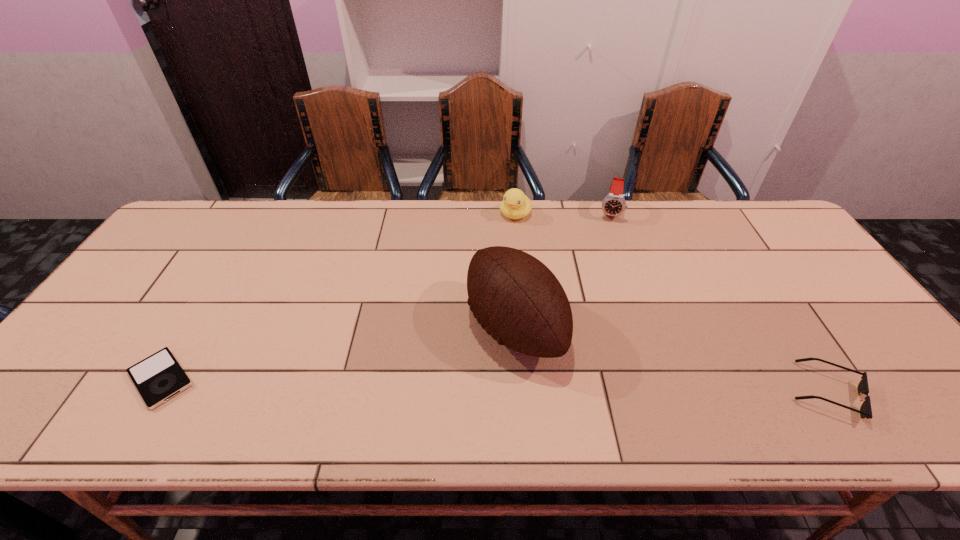
The image size is (960, 540). What are the coordinates of `free space on the desktop that is between the iPod and the fourth tallest object and is positioned on the laces of the tallest object` in the screenshot? It's located at (396, 383).

Identify the location of free spot on the desktop that is between the shortest object and the sunglasses and is positioned on the face of the watch. (587, 387).

At what (x,y) coordinates should I click in order to perform the action: click on vacant space on the desktop that is between the leftmost object and the second shortest object and is positioned at the beak of the duckling. Please return your answer as a coordinate pair (x, y). Looking at the image, I should click on (403, 383).